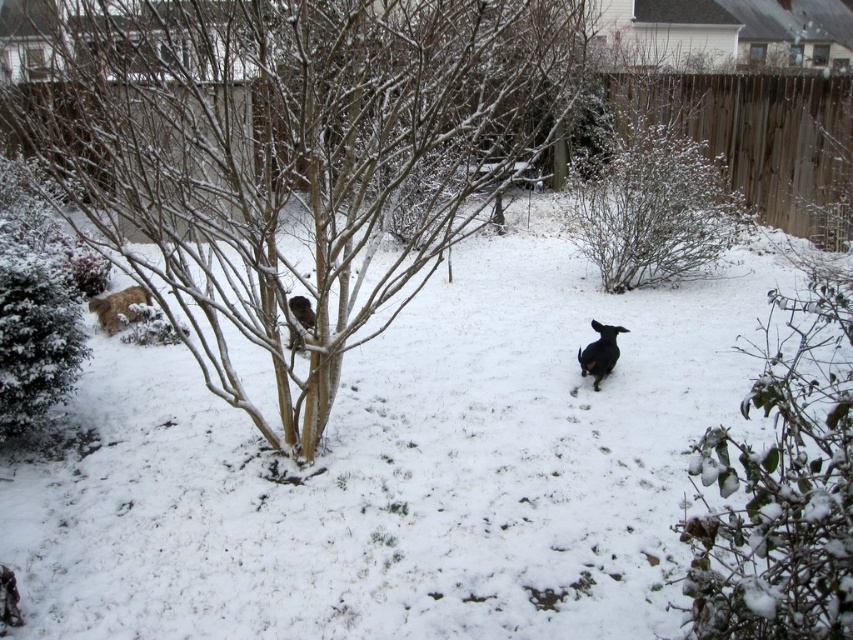
Question: Does white fluffy snow at center appear under snow-covered branches at center?

Choices:
 (A) no
 (B) yes

Answer: (B)

Question: Can you confirm if white fluffy snow at center is wider than green matte bush at left?

Choices:
 (A) no
 (B) yes

Answer: (A)

Question: Among these objects, which one is farthest from the camera?

Choices:
 (A) white fluffy snow at center
 (B) snow-covered branches at center

Answer: (B)

Question: In this image, where is snow-covered branches at center located relative to green matte bush at left?

Choices:
 (A) below
 (B) above

Answer: (A)

Question: Which of the following is the closest to the observer?

Choices:
 (A) (51, 301)
 (B) (219, 93)

Answer: (B)

Question: Estimate the real-world distances between objects in this image. Which object is farther from the snow-covered branches at center?

Choices:
 (A) white fluffy snow at center
 (B) green matte bush at left

Answer: (B)